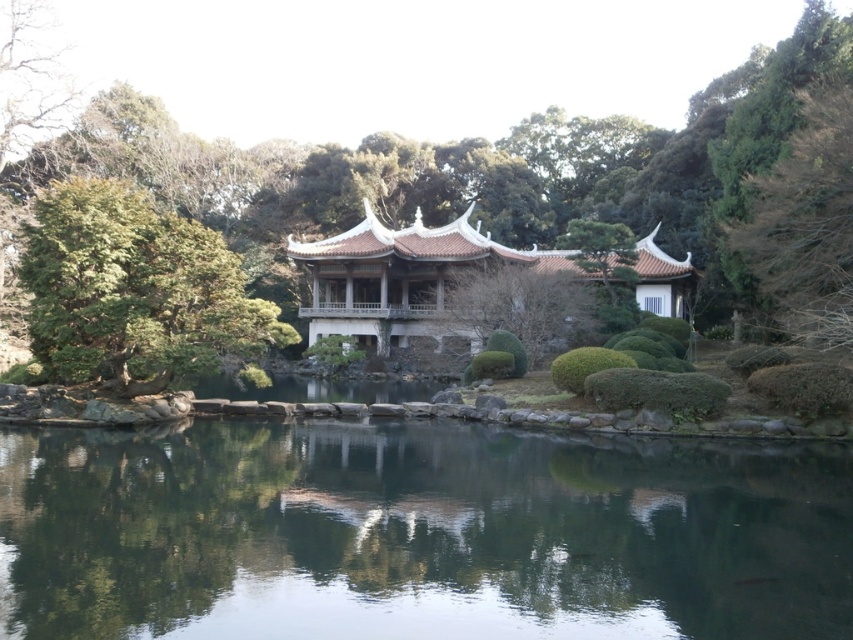
Question: Estimate the real-world distances between objects in this image. Which object is closer to the green leafy tree at left?

Choices:
 (A) transparent glass water at center
 (B) green leafy tree at center
 (C) wooden gazebo at center
 (D) green leafy tree at upper right

Answer: (A)

Question: Is the position of transparent glass water at center more distant than that of green leafy tree at left?

Choices:
 (A) yes
 (B) no

Answer: (B)

Question: Does green leafy tree at left have a larger size compared to wooden gazebo at center?

Choices:
 (A) no
 (B) yes

Answer: (B)

Question: Is transparent glass water at center bigger than green leafy tree at center?

Choices:
 (A) yes
 (B) no

Answer: (B)

Question: Which object is closer to the camera taking this photo?

Choices:
 (A) transparent glass water at center
 (B) green leafy tree at left
 (C) green leafy tree at center

Answer: (A)

Question: Which of these objects is positioned closest to the green leafy tree at left?

Choices:
 (A) transparent glass water at center
 (B) wooden gazebo at center

Answer: (A)